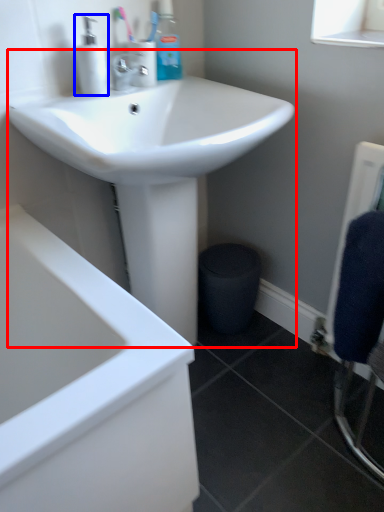
Question: Among these objects, which one is farthest to the camera, sink (highlighted by a red box) or soap dispenser (highlighted by a blue box)?

Choices:
 (A) sink
 (B) soap dispenser

Answer: (B)